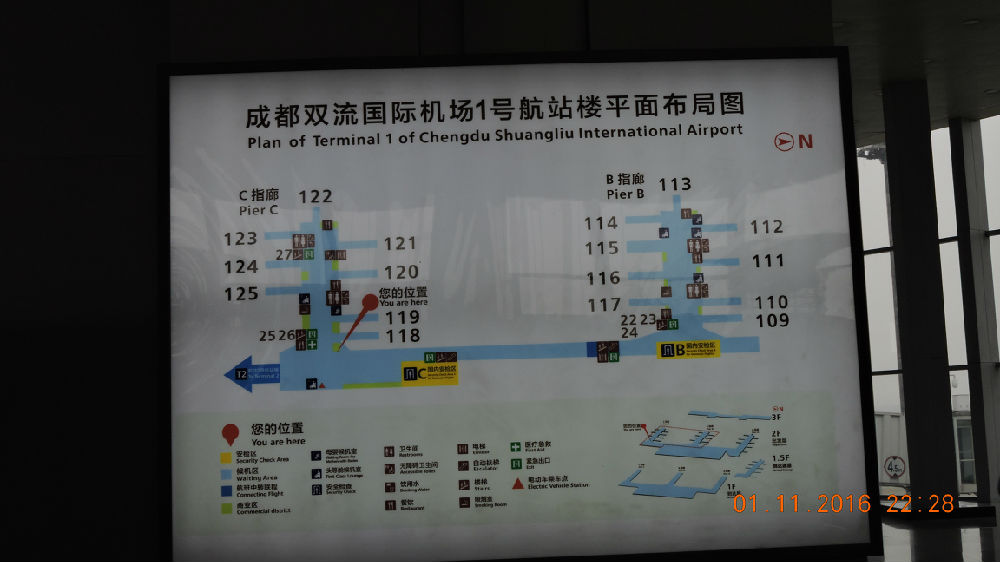
The height and width of the screenshot is (562, 1000). Identify the location of floor. (935, 556).